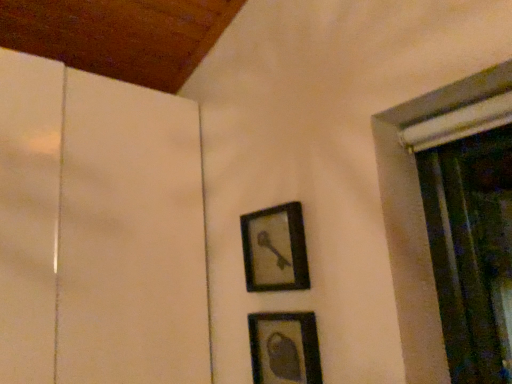
Question: Should I look upward or downward to see matte black picture frame at lower center, the second picture frame positioned from the top?

Choices:
 (A) down
 (B) up

Answer: (A)

Question: From a real-world perspective, is matte black picture frame at lower center, the second picture frame positioned from the top, beneath matte black picture frame at center, placed as the second picture frame when sorted from bottom to top?

Choices:
 (A) no
 (B) yes

Answer: (B)

Question: Can you confirm if matte black picture frame at lower center, acting as the first picture frame starting from the bottom, is taller than matte black picture frame at center, placed as the second picture frame when sorted from bottom to top?

Choices:
 (A) yes
 (B) no

Answer: (B)

Question: Does matte black picture frame at lower center, acting as the first picture frame starting from the bottom, turn towards matte black picture frame at center, placed as the second picture frame when sorted from bottom to top?

Choices:
 (A) yes
 (B) no

Answer: (B)

Question: Is matte black picture frame at center, placed as the second picture frame when sorted from bottom to top, at the back of matte black picture frame at lower center, acting as the first picture frame starting from the bottom?

Choices:
 (A) no
 (B) yes

Answer: (A)

Question: Considering the relative sizes of matte black picture frame at lower center, acting as the first picture frame starting from the bottom, and matte black picture frame at center, placed as the second picture frame when sorted from bottom to top, in the image provided, is matte black picture frame at lower center, acting as the first picture frame starting from the bottom, smaller than matte black picture frame at center, placed as the second picture frame when sorted from bottom to top,?

Choices:
 (A) no
 (B) yes

Answer: (B)

Question: Can you confirm if matte black picture frame at lower center, the second picture frame positioned from the top, is bigger than matte black picture frame at center, placed as the second picture frame when sorted from bottom to top?

Choices:
 (A) yes
 (B) no

Answer: (B)

Question: From the image's perspective, is matte black picture frame at center, placed as the first picture frame when sorted from top to bottom, over matte black picture frame at lower center, acting as the first picture frame starting from the bottom?

Choices:
 (A) yes
 (B) no

Answer: (A)

Question: From the image's perspective, is matte black picture frame at center, placed as the first picture frame when sorted from top to bottom, beneath matte black picture frame at lower center, acting as the first picture frame starting from the bottom?

Choices:
 (A) yes
 (B) no

Answer: (B)

Question: Does matte black picture frame at center, placed as the first picture frame when sorted from top to bottom, come behind matte black picture frame at lower center, acting as the first picture frame starting from the bottom?

Choices:
 (A) no
 (B) yes

Answer: (B)

Question: Is there a large distance between matte black picture frame at center, placed as the first picture frame when sorted from top to bottom, and matte black picture frame at lower center, acting as the first picture frame starting from the bottom?

Choices:
 (A) no
 (B) yes

Answer: (A)

Question: Can we say matte black picture frame at center, placed as the first picture frame when sorted from top to bottom, lies outside matte black picture frame at lower center, the second picture frame positioned from the top?

Choices:
 (A) no
 (B) yes

Answer: (B)

Question: Does matte black picture frame at center, placed as the first picture frame when sorted from top to bottom, appear on the left side of matte black picture frame at lower center, the second picture frame positioned from the top?

Choices:
 (A) no
 (B) yes

Answer: (B)

Question: Considering their positions, is matte black picture frame at lower center, acting as the first picture frame starting from the bottom, located in front of or behind matte black picture frame at center, placed as the second picture frame when sorted from bottom to top?

Choices:
 (A) behind
 (B) front

Answer: (B)